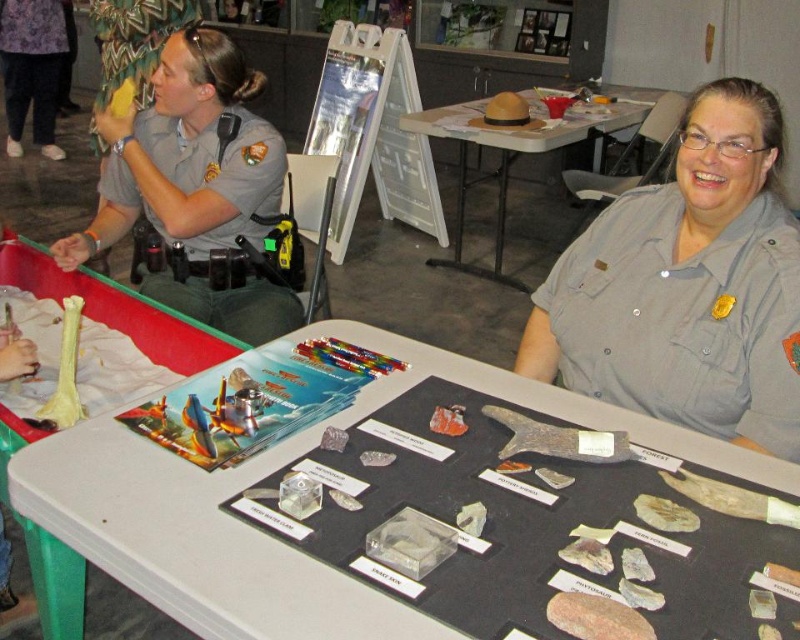
Can you confirm if matte gray uniform at left is shorter than wooden folding table at upper center?

Yes, matte gray uniform at left is shorter than wooden folding table at upper center.

Does point (236, 193) lie in front of point (440, 115)?

That is True.

Locate an element on the screen. matte gray uniform at left is located at coordinates (194, 184).

Can you confirm if matte gray uniform at left is thinner than white plastic table at left?

Yes, matte gray uniform at left is thinner than white plastic table at left.

Is point (242, 90) farther from viewer compared to point (49, 289)?

No.

The height and width of the screenshot is (640, 800). Describe the element at coordinates (194, 184) in the screenshot. I see `matte gray uniform at left` at that location.

At what (x,y) coordinates should I click in order to perform the action: click on matte gray uniform at left. Please return your answer as a coordinate pair (x, y). The height and width of the screenshot is (640, 800). Looking at the image, I should click on (194, 184).

Is wooden folding table at upper center to the right of purple fabric pants at upper left from the viewer's perspective?

Yes, wooden folding table at upper center is to the right of purple fabric pants at upper left.

Does point (450, 264) come in front of point (32, 19)?

Yes, it is in front of point (32, 19).

At what (x,y) coordinates should I click in order to perform the action: click on wooden folding table at upper center. Please return your answer as a coordinate pair (x, y). This screenshot has width=800, height=640. Looking at the image, I should click on (532, 154).